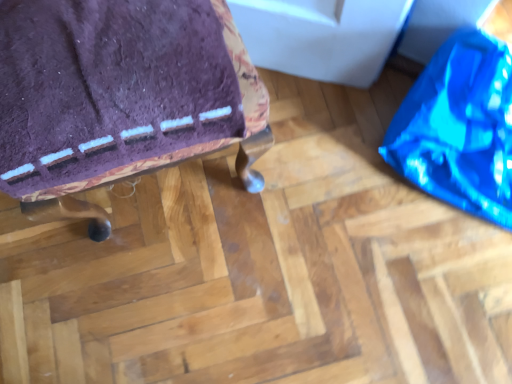
At what (x,y) coordinates should I click in order to perform the action: click on free space between purple fabric cushion at upper left and shiny blue bean bag at right. Please return your answer as a coordinate pair (x, y). This screenshot has height=384, width=512. Looking at the image, I should click on (313, 172).